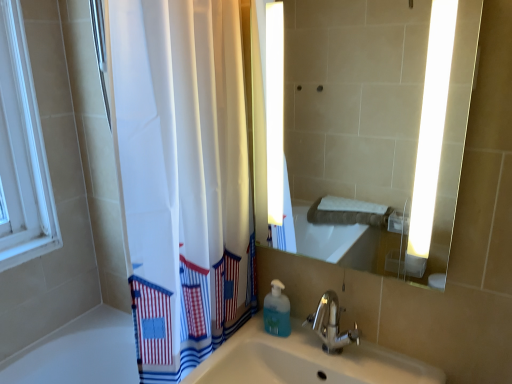
Question: From the image's perspective, relative to matte glass mirror at center, is blue translucent soap dispenser at lower center above or below?

Choices:
 (A) below
 (B) above

Answer: (A)

Question: From a real-world perspective, is blue translucent soap dispenser at lower center positioned above or below matte glass mirror at center?

Choices:
 (A) below
 (B) above

Answer: (A)

Question: Which object is the farthest from the matte glass mirror at center?

Choices:
 (A) chrome metallic faucet at center
 (B) blue translucent soap dispenser at lower center

Answer: (B)

Question: Which is farther from the chrome metallic faucet at center?

Choices:
 (A) matte glass mirror at center
 (B) blue translucent soap dispenser at lower center

Answer: (A)